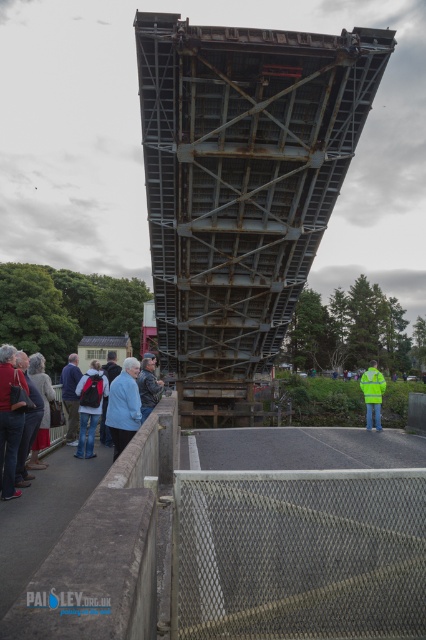
Question: Which of the following is the farthest from the observer?

Choices:
 (A) (143, 410)
 (B) (137, 404)
 (C) (362, 380)
 (D) (40, 374)

Answer: (C)

Question: Can you confirm if blue fabric jacket at center is wider than dark gray fabric jacket at lower left?

Choices:
 (A) yes
 (B) no

Answer: (A)

Question: Is rusty metal bridge at center bigger than denim jacket at lower left?

Choices:
 (A) yes
 (B) no

Answer: (A)

Question: Which of the following is the closest to the observer?

Choices:
 (A) (94, 384)
 (B) (5, 420)
 (C) (149, 396)

Answer: (B)

Question: Does light brown leather jacket at lower left have a greater width compared to bright yellow jacket at center?

Choices:
 (A) no
 (B) yes

Answer: (A)

Question: Which point appears farthest from the camera in this image?

Choices:
 (A) (43, 448)
 (B) (371, 388)
 (C) (37, 353)
 (D) (16, 419)

Answer: (C)